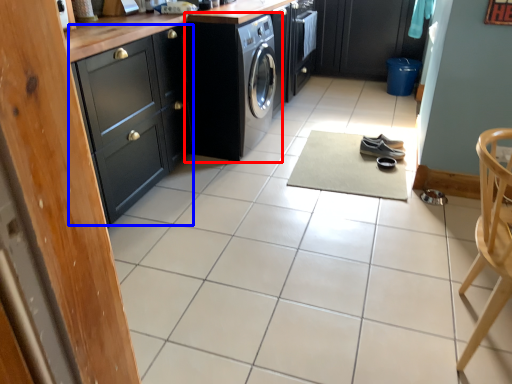
Question: Which object appears closest to the camera in this image, washing machine (highlighted by a red box) or cabinetry (highlighted by a blue box)?

Choices:
 (A) washing machine
 (B) cabinetry

Answer: (B)